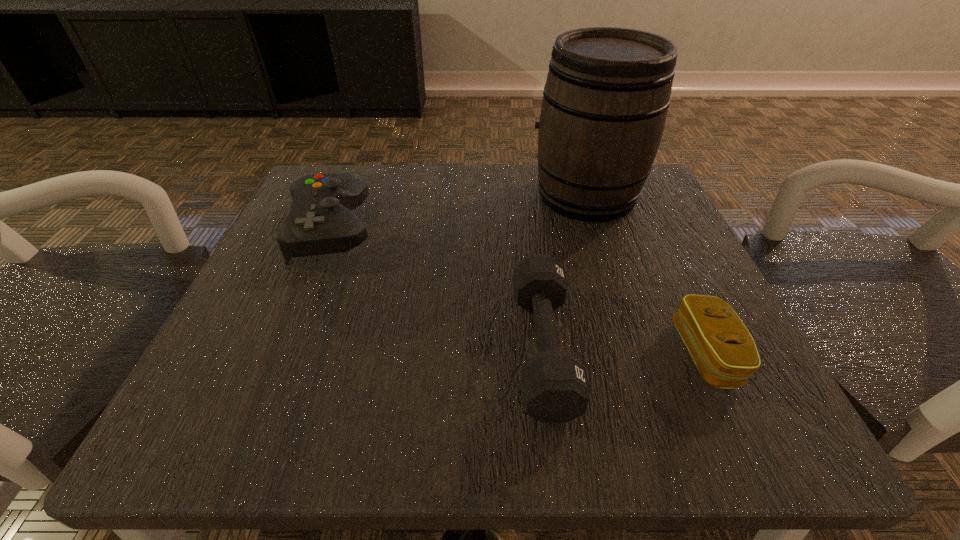
The width and height of the screenshot is (960, 540). What are the coordinates of `free space between the dumbbell and the leftmost object` in the screenshot? It's located at (437, 289).

Identify which object is the second nearest to the dumbbell. Please provide its 2D coordinates. Your answer should be formatted as a tuple, i.e. [(x, y)], where the tuple contains the x and y coordinates of a point satisfying the conditions above.

[(605, 101)]

Identify the location of object that is the closest one to the clutch bag. This screenshot has width=960, height=540. (555, 388).

Where is `vacant area in the image that satisfies the following two spatial constraints: 1. on the back side of the control; 2. on the right side of the wine bucket`? vacant area in the image that satisfies the following two spatial constraints: 1. on the back side of the control; 2. on the right side of the wine bucket is located at coordinates (345, 195).